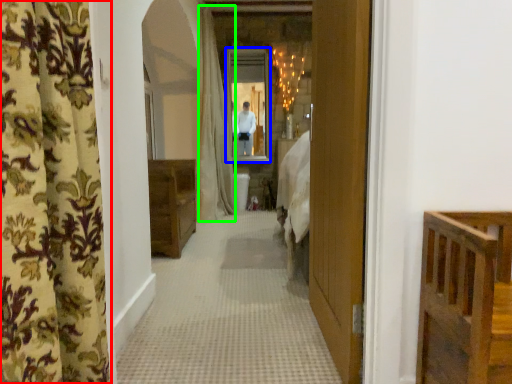
Question: Which object is the farthest from curtain (highlighted by a red box)? Choose among these: mirror (highlighted by a blue box) or shower curtain (highlighted by a green box).

Choices:
 (A) mirror
 (B) shower curtain

Answer: (A)